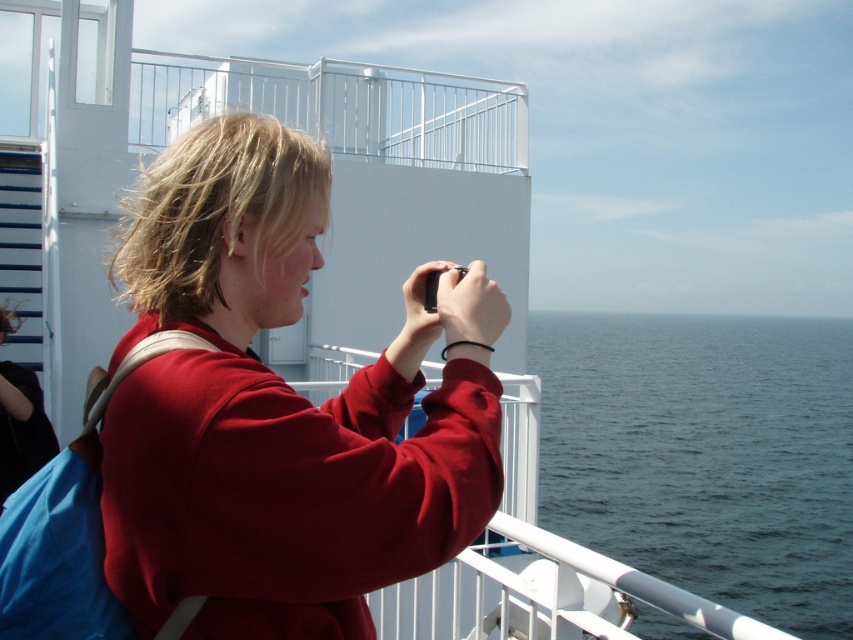
You are a photographer trying to capture a clear shot of the white metal railing at upper center. However, the matte red sweatshirt at center is blocking your view. Can you adjust your position to see the railing behind the sweatshirt?

The matte red sweatshirt at center is in front of the white metal railing at upper center, so you can move your position to either side of the sweatshirt to see the railing behind it.

You are a photographer on a ferry deck. You have a matte black jacket at left and blue water at right in your viewfinder. Which object occupies more horizontal space in your photo?

The blue water at right occupies more horizontal space in your photo because its width is larger than that of the matte black jacket at left.

You are a photographer on a ferry deck. You notice two items on the person in front of you. The items are the matte red sweatshirt at center and the matte black jacket at left. Which item is covering part of the other?

The matte red sweatshirt at center is positioned over the matte black jacket at left, so it is covering part of the matte black jacket at left.